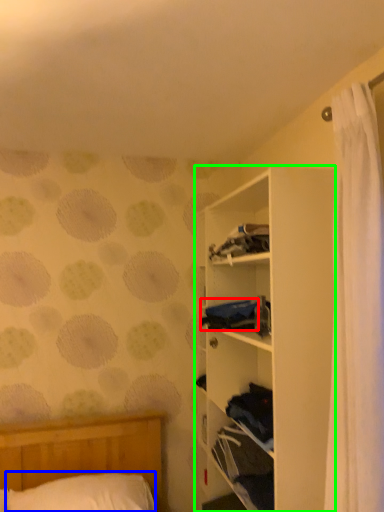
Question: Based on their relative distances, which object is farther from clothing (highlighted by a red box)? Choose from pillow (highlighted by a blue box) and shelf (highlighted by a green box).

Choices:
 (A) pillow
 (B) shelf

Answer: (A)